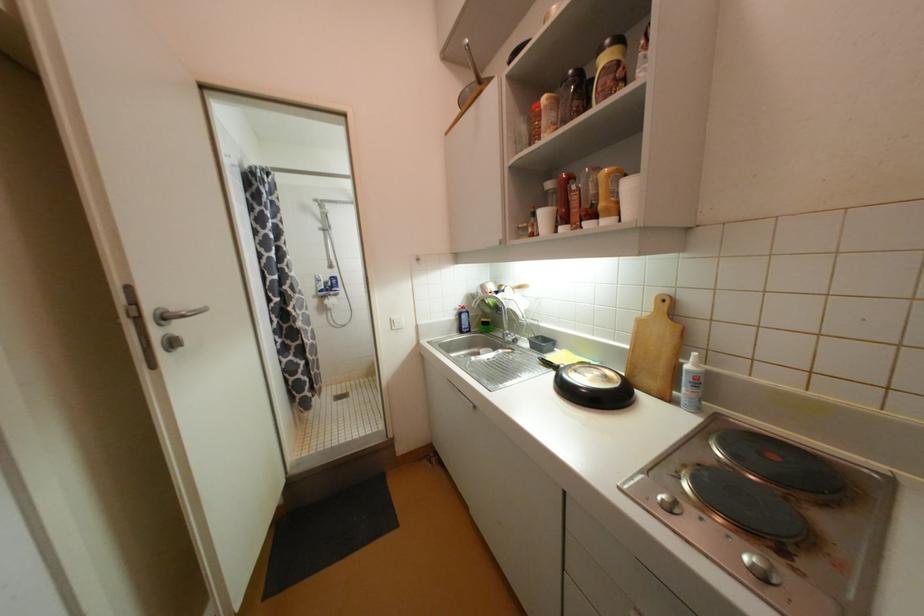
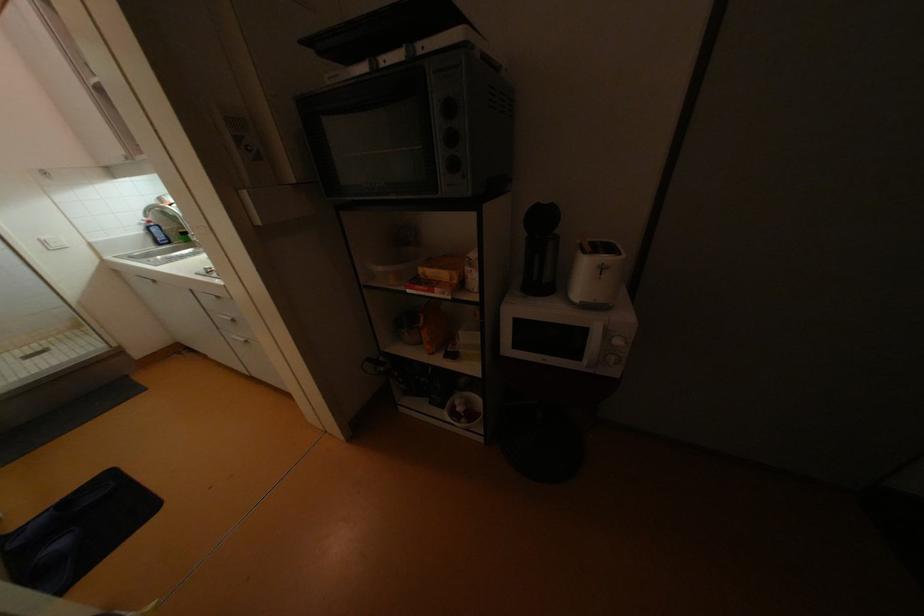
Question: I am providing you with two images of the same scene from different viewpoints. After the viewpoint changes to image2, which objects are now occluded?

Choices:
 (A) white cabinet handle
 (B) small white notepad
 (C) wooden cutting board
 (D) silver drawer handle

Answer: (C)